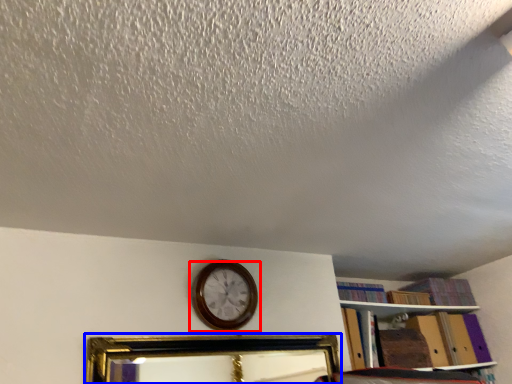
Question: Among these objects, which one is nearest to the camera, wall clock (highlighted by a red box) or picture frame (highlighted by a blue box)?

Choices:
 (A) wall clock
 (B) picture frame

Answer: (B)